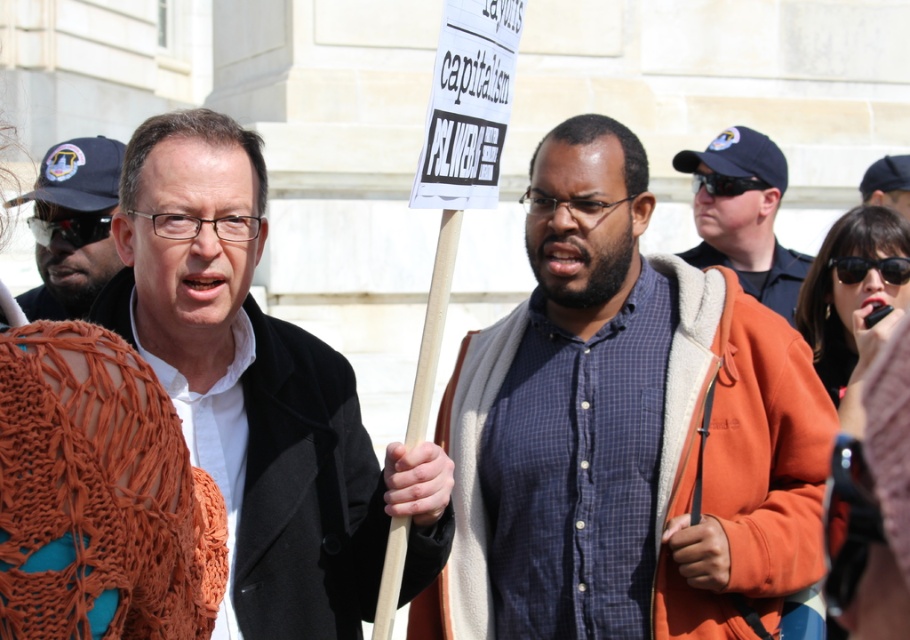
Based on the scene description, which object is taller between the blue plaid shirt at center and the matte black sunglasses at left?

The blue plaid shirt at center is taller than the matte black sunglasses at left according to the description.

From the picture: You are a photographer trying to capture both the blue plaid shirt at center and the blue uniform at center in a single frame. Which one should you focus on first to ensure it appears larger in the photo?

The blue plaid shirt at center is larger in size than the blue uniform at center, so you should focus on the blue plaid shirt at center first to ensure it appears larger in the photo.